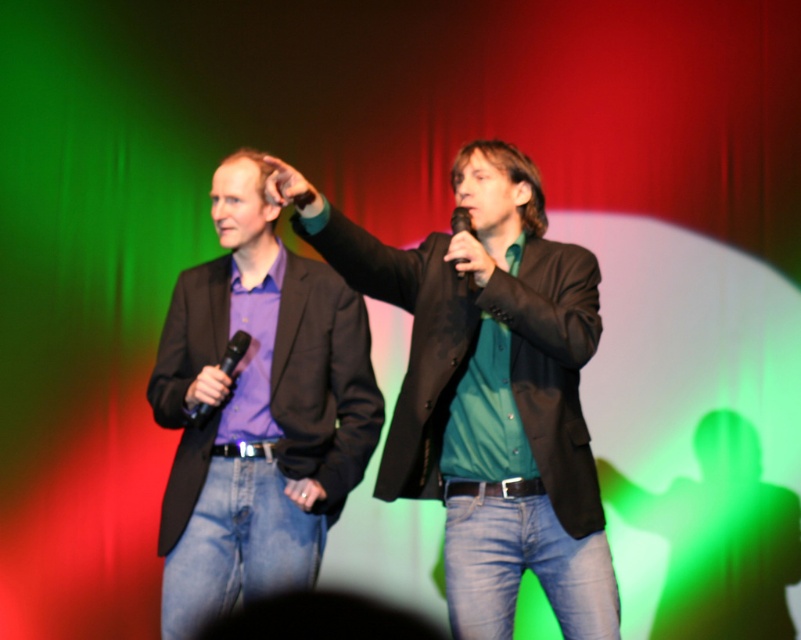
You are a sound technician setting up for a live event. You have two microphones on stage. The black matte microphone at left and the black matte microphone at upper center. Which microphone should you adjust first if you need to prioritize the one that takes up more space?

The black matte microphone at upper center should be adjusted first because it occupies more space than the black matte microphone at left.

You are standing at the origin point of the coordinate system in the image. You need to locate the green matte shirt at center. What are its coordinates?

The coordinates of the green matte shirt at center are at point (488, 388).